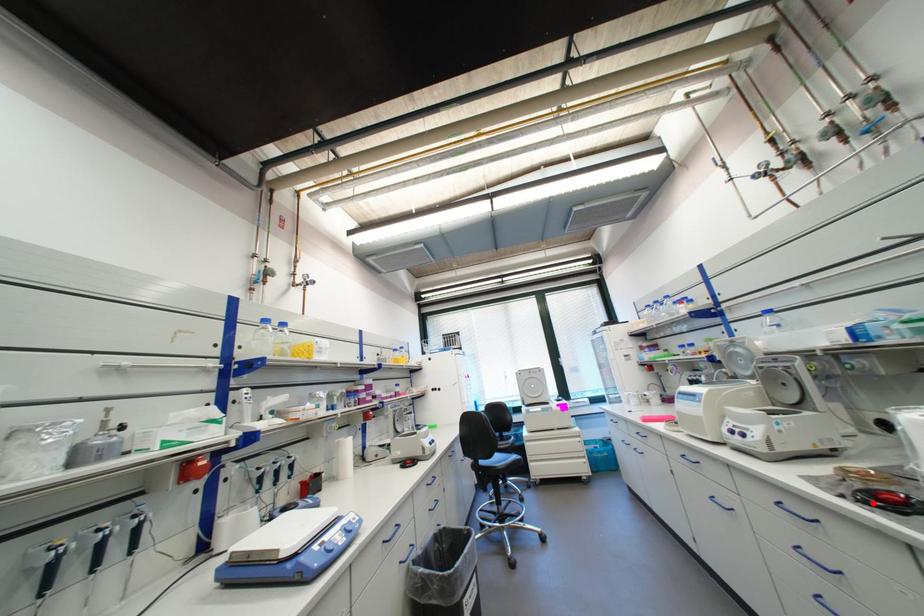
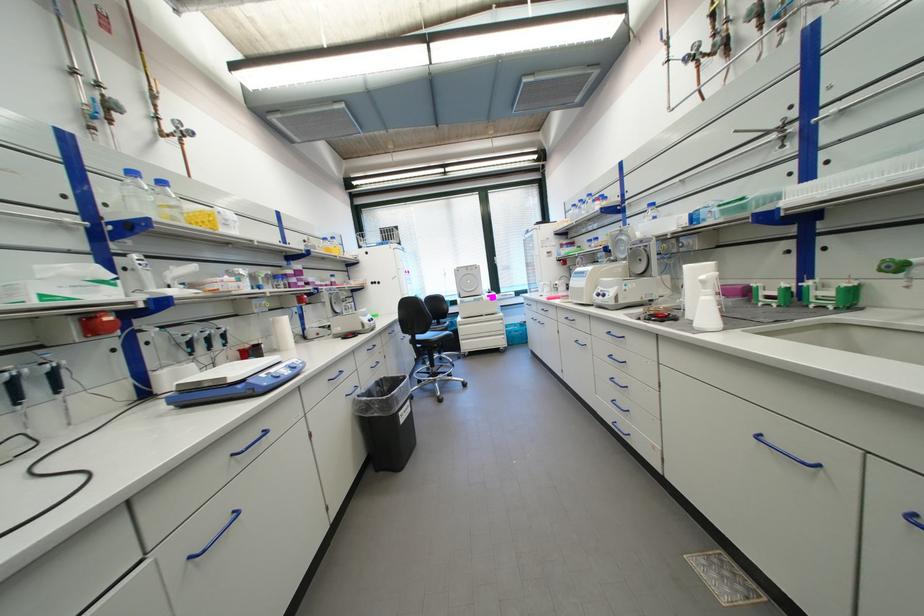
The point at the highlighted location is marked in the first image. Where is the corresponding point in the second image?

(655, 321)